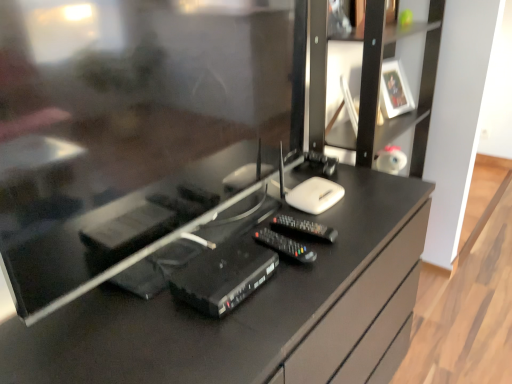
The image size is (512, 384). Find the location of `free space on the front side of black plastic remote at center`. free space on the front side of black plastic remote at center is located at coordinates (318, 269).